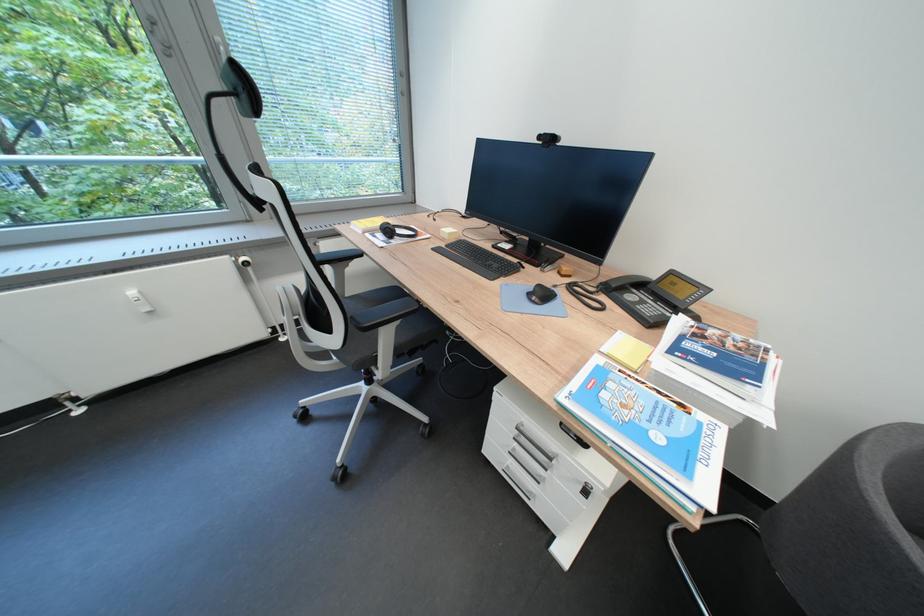
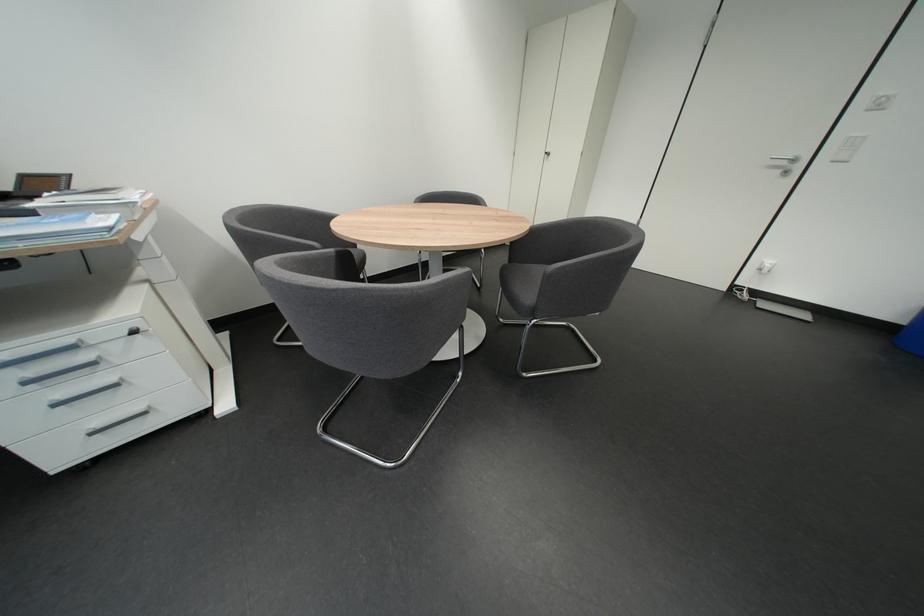
How did the camera likely rotate?

The camera rotated toward right-down.